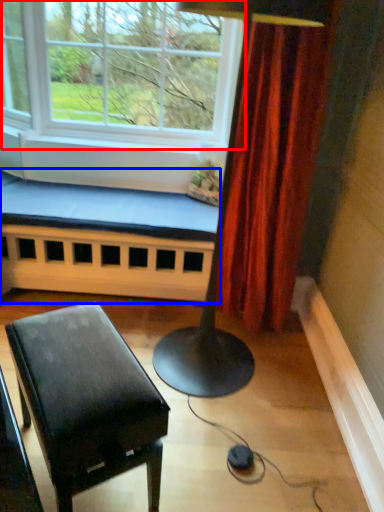
Question: Which object is closer to the camera taking this photo, window (highlighted by a red box) or church bench (highlighted by a blue box)?

Choices:
 (A) window
 (B) church bench

Answer: (A)